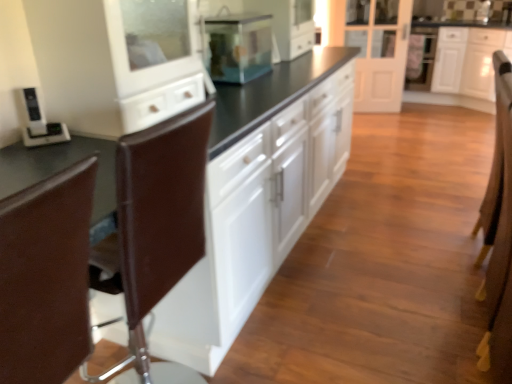
At what (x,y) coordinates should I click in order to perform the action: click on free space to the back side of brown leather armchair at right. Please return your answer as a coordinate pair (x, y). The image size is (512, 384). Looking at the image, I should click on (441, 223).